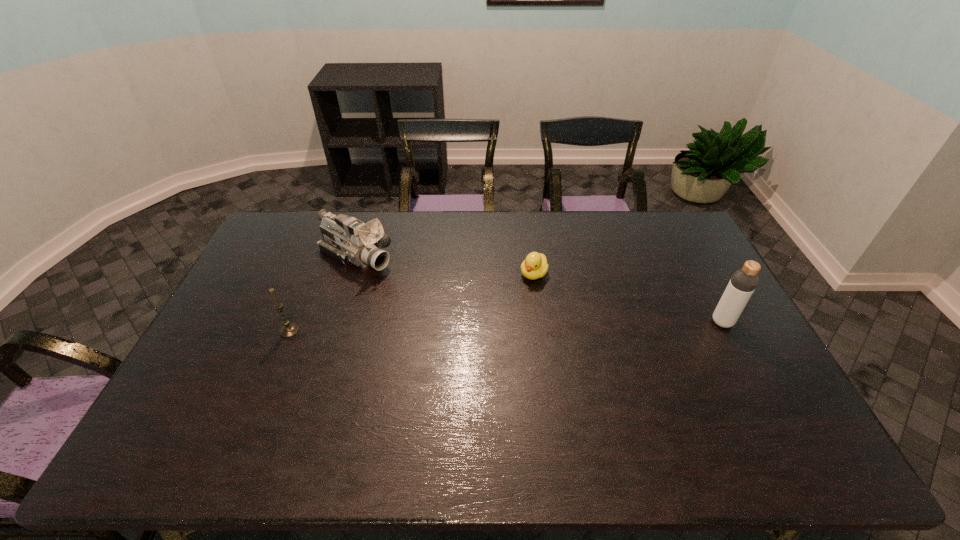
Locate an element on the screen. The width and height of the screenshot is (960, 540). free spot on the desktop that is between the candle and the tallest object and is positioned on the beak of the third object from left to right is located at coordinates (493, 327).

Image resolution: width=960 pixels, height=540 pixels. What are the coordinates of `free spot on the desktop that is between the candle and the tallest object and is positioned on the front-facing side of the camcorder` in the screenshot? It's located at (476, 327).